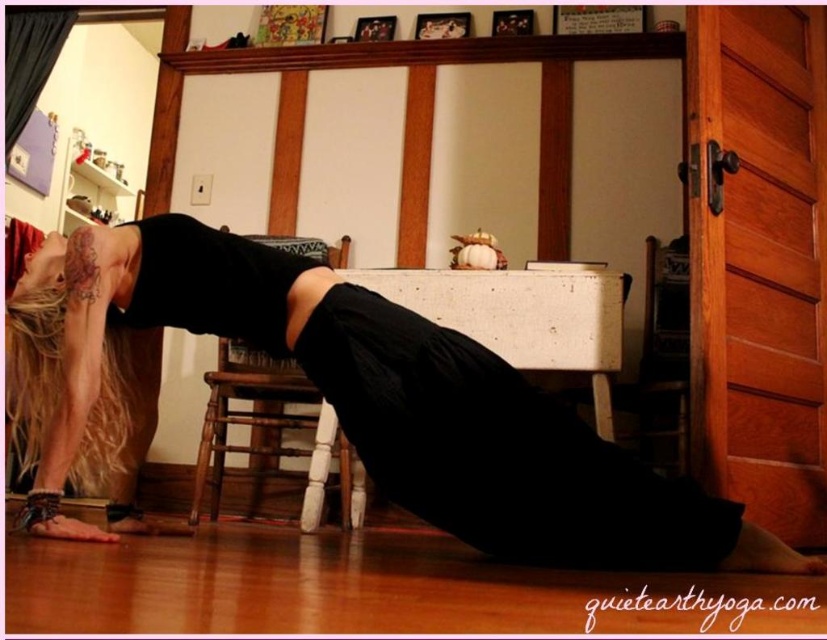
Who is more forward, (206, 240) or (495, 532)?

Point (495, 532) is in front.

Measure the distance between black matte yoga mat at lower center and camera.

black matte yoga mat at lower center is 4.64 feet away from camera.

Is point (562, 502) behind point (514, 417)?

No, it is not.

Locate an element on the screen. This screenshot has height=640, width=827. black matte yoga mat at lower center is located at coordinates (349, 401).

Does point (686, 506) lie behind point (227, 401)?

No, (686, 506) is closer to viewer.

Is point (488, 534) positioned in front of point (342, 492)?

Yes.

Locate an element on the screen. The image size is (827, 640). black matte dress at lower center is located at coordinates (496, 448).

Between point (367, 378) and point (357, 513), which one is positioned in front?

Point (367, 378)

Is black matte yoga mat at lower center thinner than white wood stool at center?

No.

Locate an element on the screen. The image size is (827, 640). black matte yoga mat at lower center is located at coordinates (349, 401).

Locate an element on the screen. black matte yoga mat at lower center is located at coordinates (349, 401).